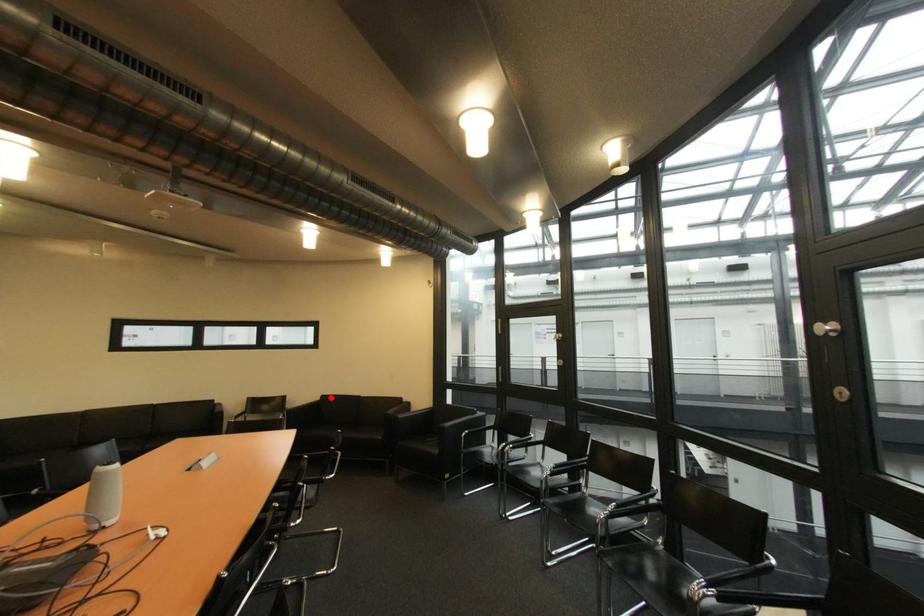
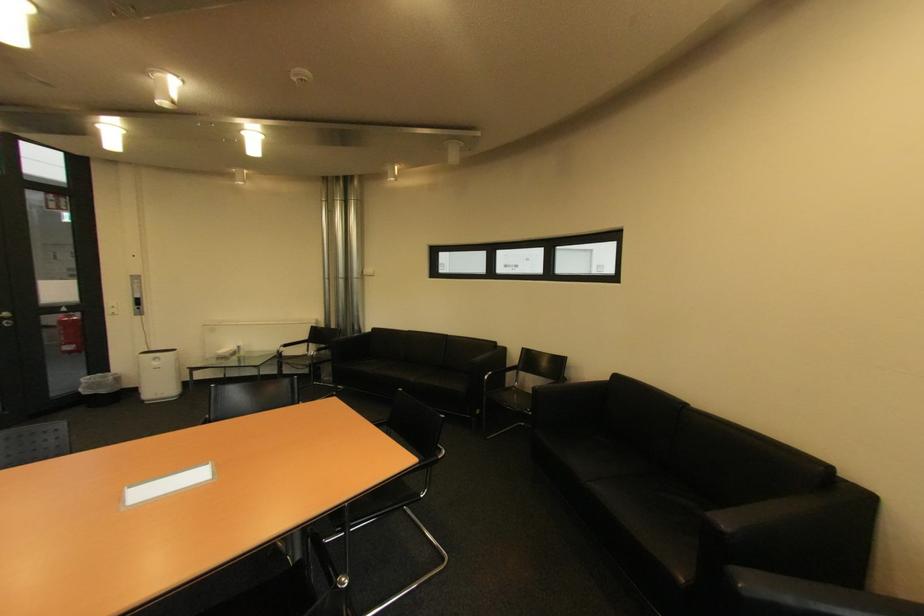
Locate, in the second image, the point that corresponds to the highlighted location in the first image.

(625, 378)